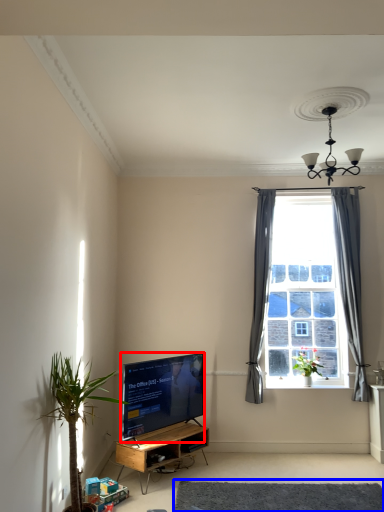
Question: Which object is closer to the camera taking this photo, television (highlighted by a red box) or plain (highlighted by a blue box)?

Choices:
 (A) television
 (B) plain

Answer: (B)